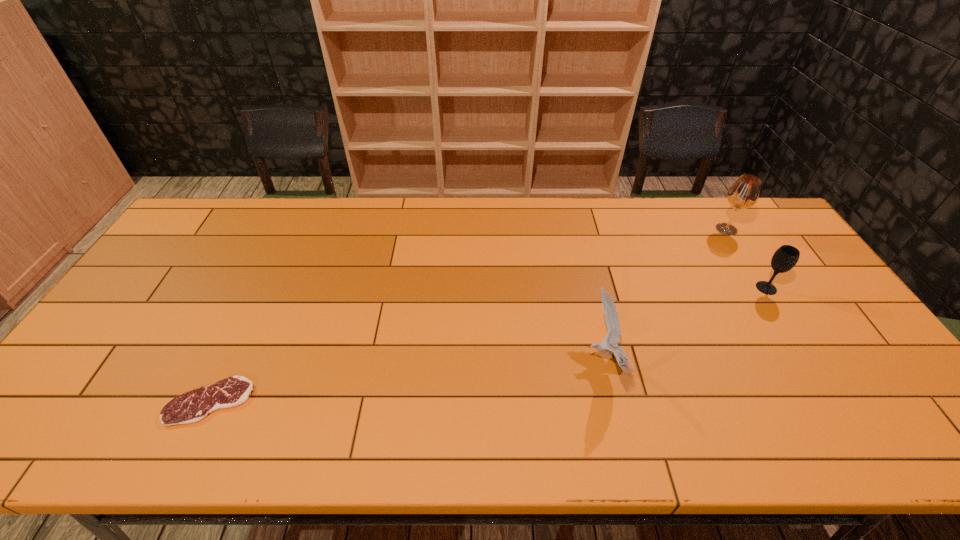
Identify the location of vacant area between the second object from left to right and the shorter wineglass. This screenshot has height=540, width=960. [685, 324].

Identify which object is located as the nearest to the farthest object. Please provide its 2D coordinates. Your answer should be formatted as a tuple, i.e. [(x, y)], where the tuple contains the x and y coordinates of a point satisfying the conditions above.

[(785, 258)]

At what (x,y) coordinates should I click in order to perform the action: click on object that stands as the second closest to the shorter wineglass. Please return your answer as a coordinate pair (x, y). This screenshot has height=540, width=960. Looking at the image, I should click on (612, 338).

Find the location of a particular element. This screenshot has height=540, width=960. blank area in the image that satisfies the following two spatial constraints: 1. on the front side of the shorter wineglass; 2. at the tip of the beak of the second object from left to right is located at coordinates (811, 360).

The image size is (960, 540). Identify the location of free location that satisfies the following two spatial constraints: 1. on the back side of the nearer wineglass; 2. on the right side of the leftmost object. (263, 288).